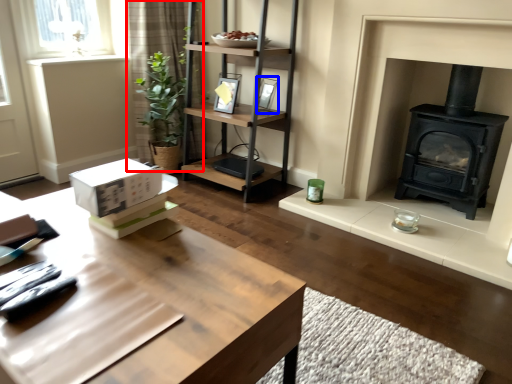
Question: Which point is closer to the camera, curtain (highlighted by a red box) or picture frame (highlighted by a blue box)?

Choices:
 (A) curtain
 (B) picture frame

Answer: (B)